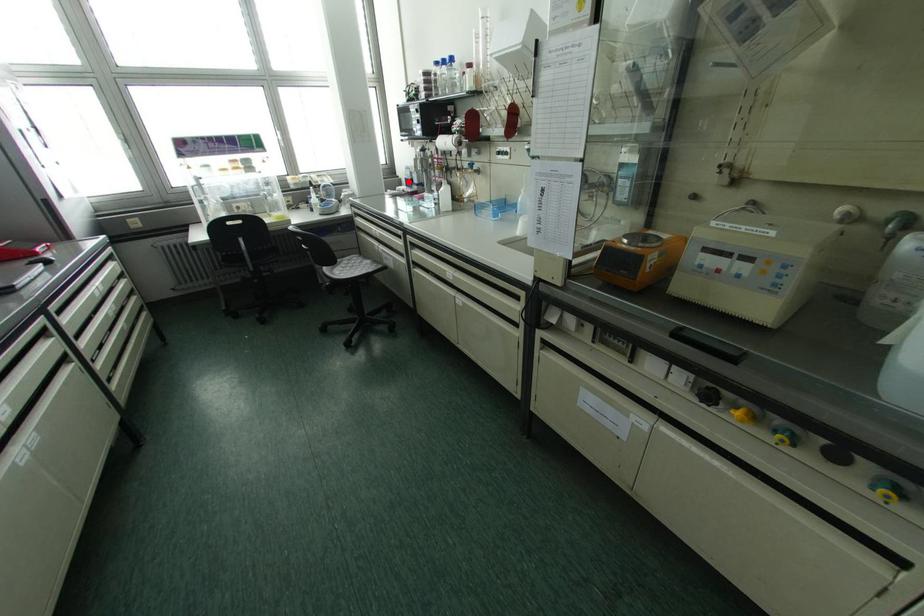
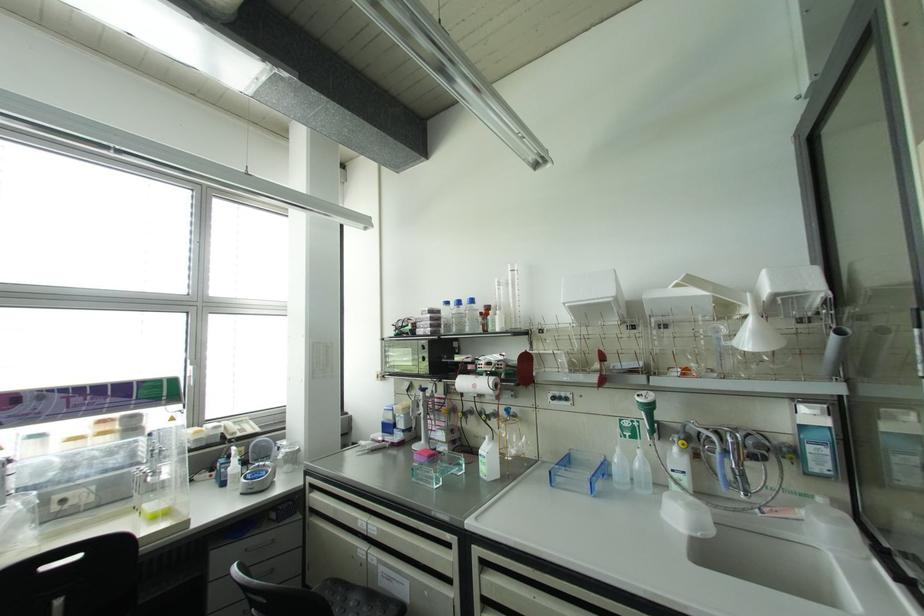
Locate, in the second image, the point that corresponds to the highlighted location in the first image.

(387, 427)